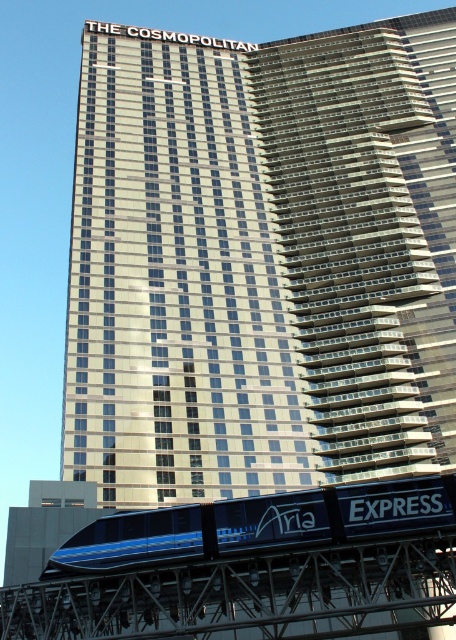
Question: Which object is farther from the camera taking this photo?

Choices:
 (A) blue glossy monorail at lower center
 (B) glassy silver skyscraper at center

Answer: (B)

Question: Which of the following is the farthest from the observer?

Choices:
 (A) (450, 77)
 (B) (383, 483)

Answer: (A)

Question: Considering the relative positions of glassy silver skyscraper at center and blue glossy monorail at lower center in the image provided, where is glassy silver skyscraper at center located with respect to blue glossy monorail at lower center?

Choices:
 (A) left
 (B) right

Answer: (B)

Question: Is glassy silver skyscraper at center behind blue glossy monorail at lower center?

Choices:
 (A) no
 (B) yes

Answer: (B)

Question: Can you confirm if glassy silver skyscraper at center is positioned to the right of blue glossy monorail at lower center?

Choices:
 (A) yes
 (B) no

Answer: (A)